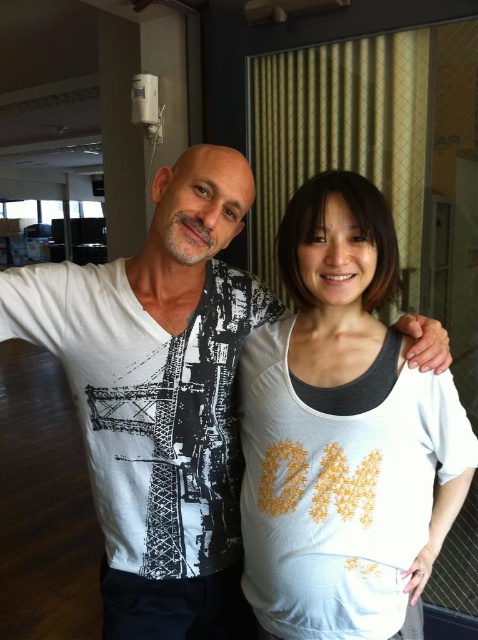
The height and width of the screenshot is (640, 478). I want to click on white cotton tank top at center, so click(343, 433).

Which is in front, point (358, 177) or point (28, 332)?

Point (358, 177) is more forward.

This screenshot has height=640, width=478. Find the location of `white cotton tank top at center`. white cotton tank top at center is located at coordinates (343, 433).

In order to click on white cotton tank top at center in this screenshot , I will do 343,433.